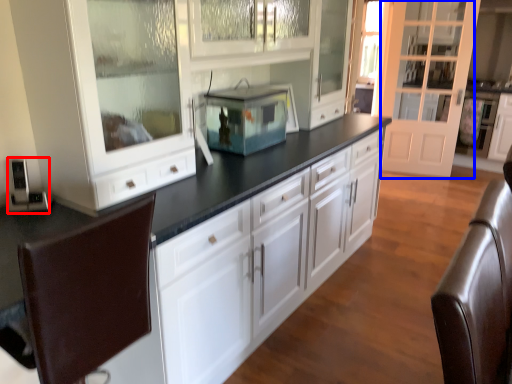
Question: Which object is further to the camera taking this photo, appliance (highlighted by a red box) or glass door (highlighted by a blue box)?

Choices:
 (A) appliance
 (B) glass door

Answer: (B)